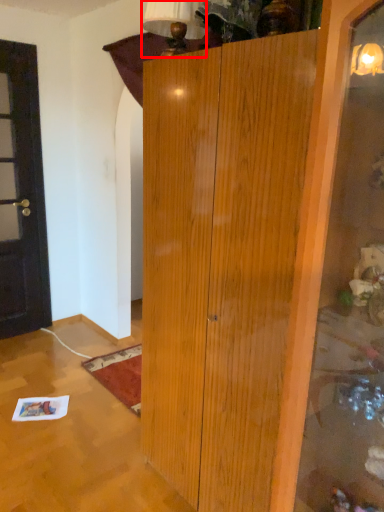
Question: From the image's perspective, what is the correct spatial relationship of lamp (annotated by the red box) in relation to door?

Choices:
 (A) below
 (B) above

Answer: (B)